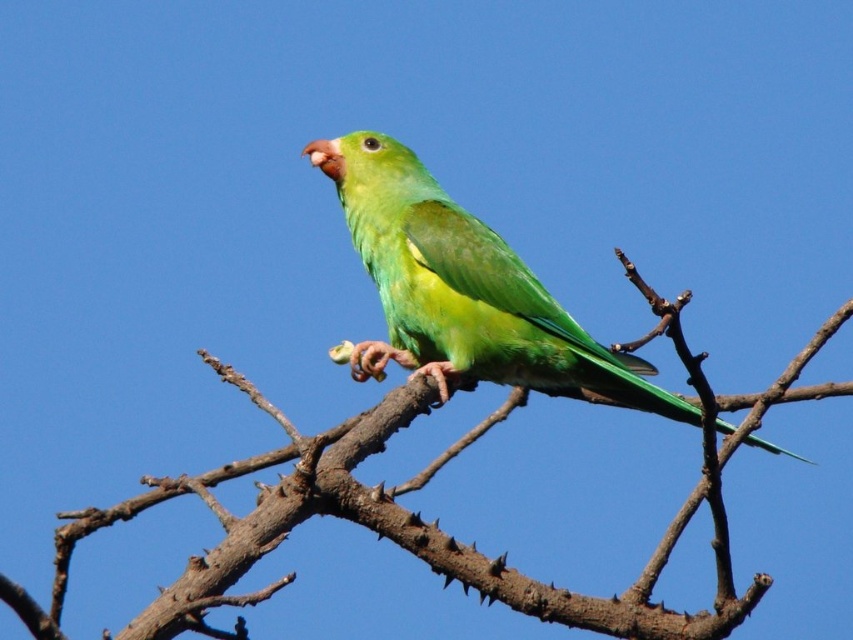
Locate an element on the screen. brown rough branch at center is located at coordinates (421, 516).